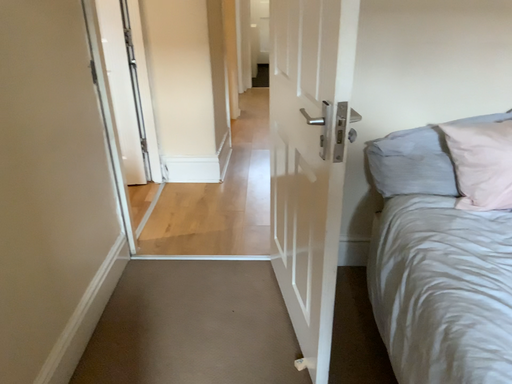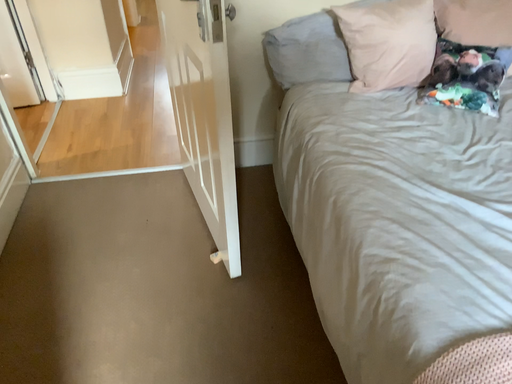
Question: Which way did the camera rotate in the video?

Choices:
 (A) rotated upward
 (B) rotated downward

Answer: (B)